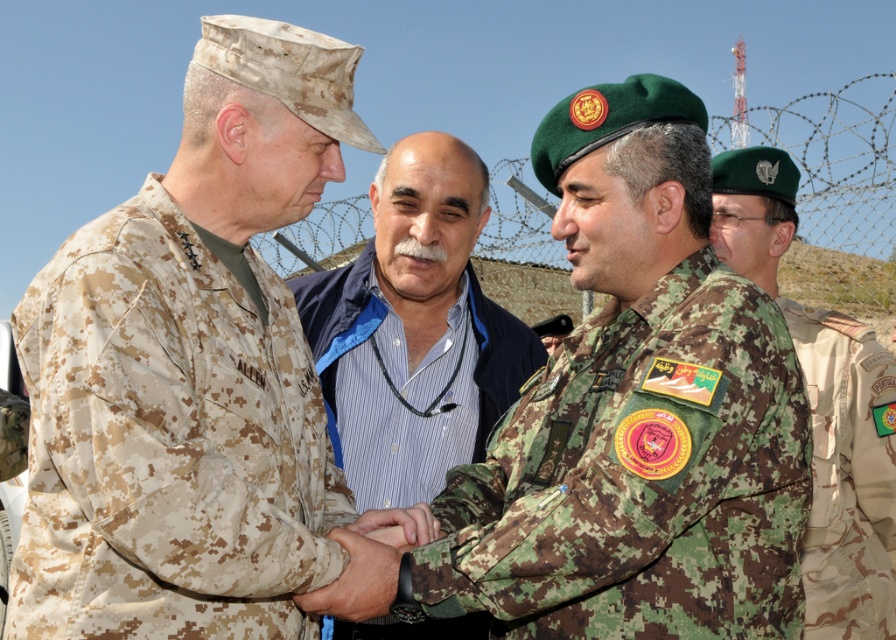
Between camouflage uniform at left and blue striped shirt at center, which one appears on the left side from the viewer's perspective?

camouflage uniform at left is more to the left.

Which is behind, point (108, 404) or point (386, 323)?

The point (386, 323) is more distant.

Is point (35, 486) farther from camera compared to point (345, 472)?

No, it is not.

Where is `camouflage uniform at left`? camouflage uniform at left is located at coordinates (192, 372).

Who is positioned more to the right, camouflage fabric uniform at center or camouflage fabric uniform at right?

Positioned to the right is camouflage fabric uniform at right.

How far apart are camouflage fabric uniform at center and camouflage fabric uniform at right?

They are 8.27 meters apart.

The width and height of the screenshot is (896, 640). Describe the element at coordinates (639, 477) in the screenshot. I see `camouflage fabric uniform at center` at that location.

Find the location of `camouflage fabric uniform at center`. camouflage fabric uniform at center is located at coordinates (639, 477).

Does camouflage uniform at left have a larger size compared to camouflage uniform at center?

Yes.

Does camouflage uniform at left come in front of camouflage uniform at center?

That is True.

Does point (227, 259) come farther from viewer compared to point (803, 323)?

No.

At what (x,y) coordinates should I click in order to perform the action: click on camouflage uniform at left. Please return your answer as a coordinate pair (x, y). The image size is (896, 640). Looking at the image, I should click on (192, 372).